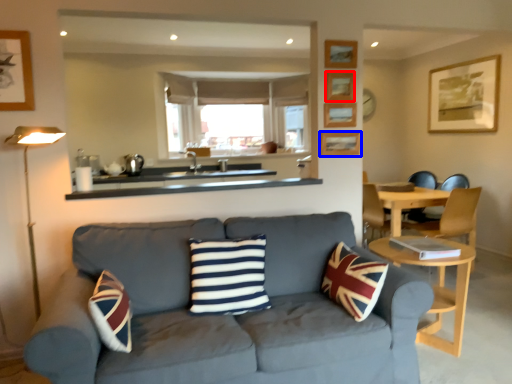
Question: Which object appears closest to the camera in this image, picture frame (highlighted by a red box) or picture frame (highlighted by a blue box)?

Choices:
 (A) picture frame
 (B) picture frame

Answer: (A)